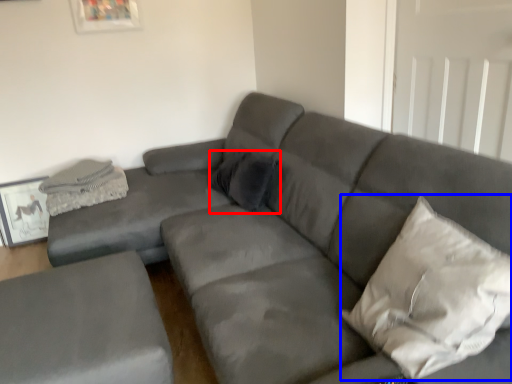
Question: Among these objects, which one is nearest to the camera, pillow (highlighted by a red box) or pillow (highlighted by a blue box)?

Choices:
 (A) pillow
 (B) pillow

Answer: (B)